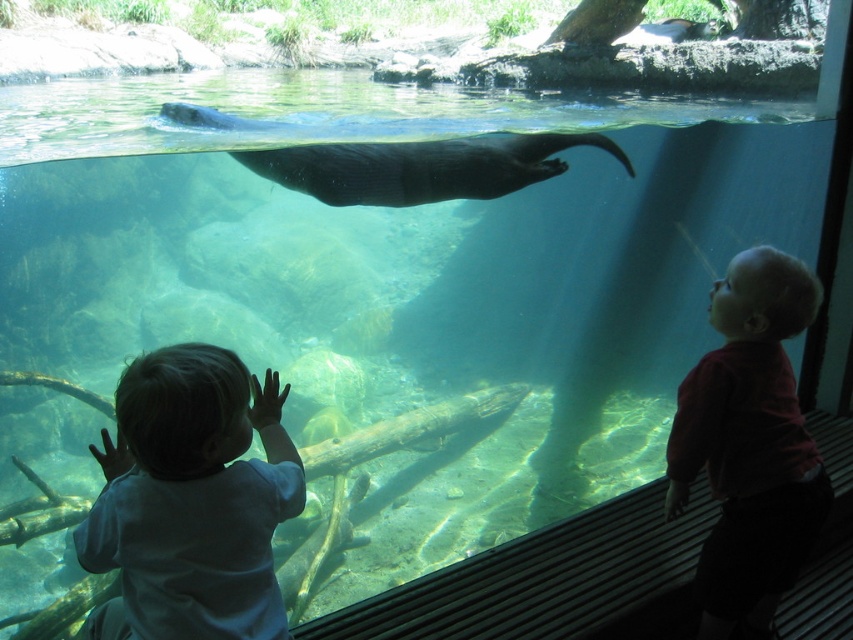
Is light blue shirt at left above dark gray fur seal at upper center?

No.

Is point (196, 438) closer to camera compared to point (329, 157)?

Yes, it is.

Is point (158, 609) positioned in front of point (300, 188)?

Yes, point (158, 609) is in front of point (300, 188).

Where is `light blue shirt at left`? light blue shirt at left is located at coordinates (190, 499).

Can you confirm if smooth red shirt at right is thinner than dark gray fur seal at upper center?

Yes, smooth red shirt at right is thinner than dark gray fur seal at upper center.

Is the position of smooth red shirt at right more distant than that of dark gray fur seal at upper center?

No.

What do you see at coordinates (749, 445) in the screenshot?
I see `smooth red shirt at right` at bounding box center [749, 445].

Where is `smooth red shirt at right`? The height and width of the screenshot is (640, 853). smooth red shirt at right is located at coordinates (749, 445).

Which is in front, point (247, 396) or point (796, 404)?

Point (247, 396) is more forward.

The height and width of the screenshot is (640, 853). What do you see at coordinates (190, 499) in the screenshot?
I see `light blue shirt at left` at bounding box center [190, 499].

Find the location of a particular element. This screenshot has width=853, height=640. light blue shirt at left is located at coordinates (190, 499).